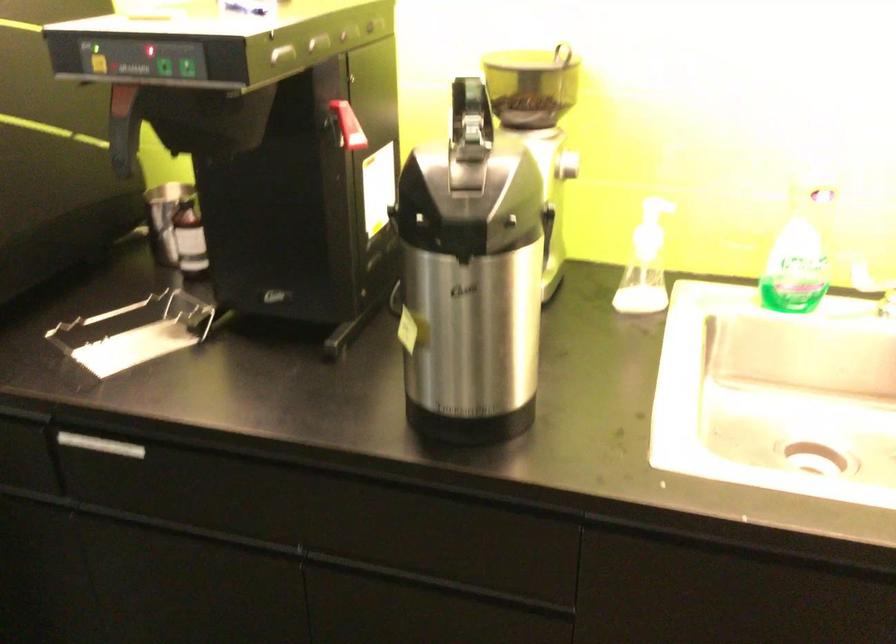
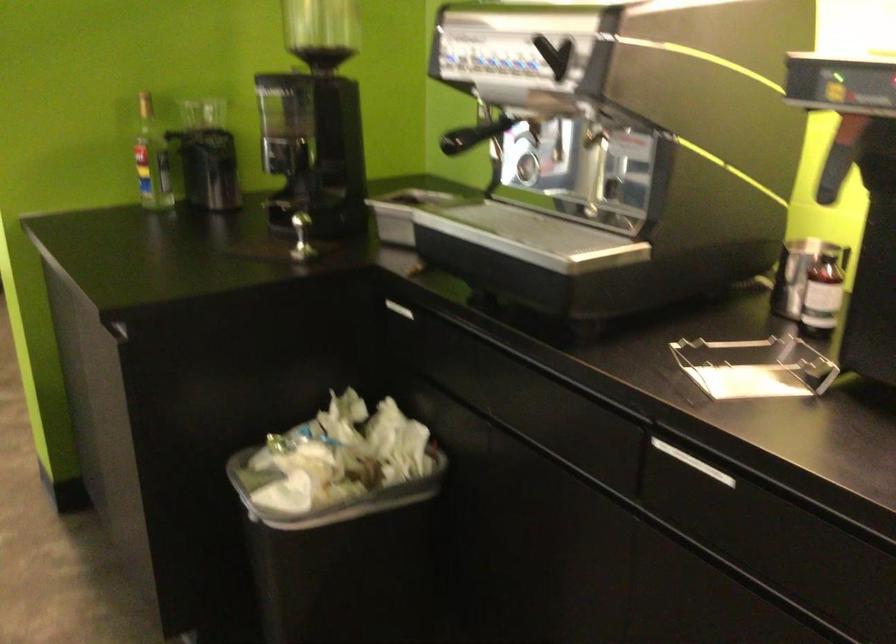
Question: The camera is either moving clockwise (left) or counter-clockwise (right) around the object. The first image is from the beginning of the video and the second image is from the end. Is the camera moving left or right when shooting the video?

Choices:
 (A) Left
 (B) Right

Answer: (B)